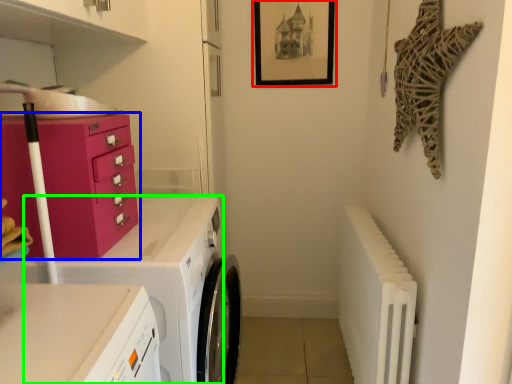
Question: Which object is the closest to the picture frame (highlighted by a red box)? Choose among these: chest of drawers (highlighted by a blue box) or home appliance (highlighted by a green box).

Choices:
 (A) chest of drawers
 (B) home appliance

Answer: (B)